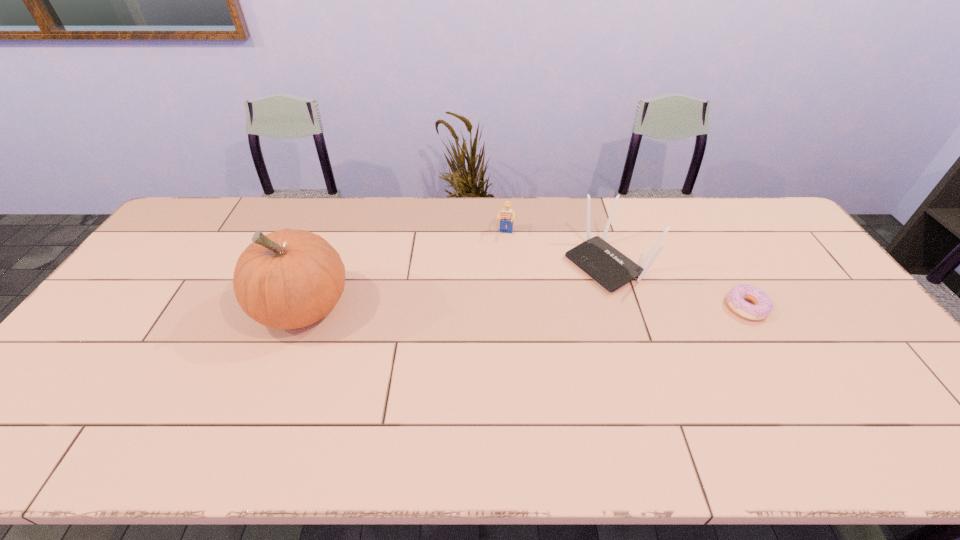
Locate an element on the screen. The image size is (960, 540). blank space located 0.390m on the stem of the pumpkin is located at coordinates (117, 307).

The image size is (960, 540). Find the location of `vacant area situated 0.170m on the back of the doughnut`. vacant area situated 0.170m on the back of the doughnut is located at coordinates (715, 254).

Where is `vacant space located 0.300m on the face of the Lego`? The height and width of the screenshot is (540, 960). vacant space located 0.300m on the face of the Lego is located at coordinates (492, 306).

This screenshot has width=960, height=540. I want to click on blank space located 0.140m on the face of the Lego, so click(x=499, y=268).

I want to click on vacant space situated on the face of the Lego, so click(489, 330).

I want to click on vacant area situated 0.090m on the front-facing side of the second tallest object, so click(554, 293).

This screenshot has width=960, height=540. I want to click on free spot located on the front-facing side of the second tallest object, so click(x=533, y=305).

Where is `vacant space located on the front-facing side of the second tallest object`? This screenshot has width=960, height=540. vacant space located on the front-facing side of the second tallest object is located at coordinates (481, 332).

Image resolution: width=960 pixels, height=540 pixels. Identify the location of Lego present at the far edge. (507, 216).

In order to click on router that is at the far edge in this screenshot , I will do `click(611, 269)`.